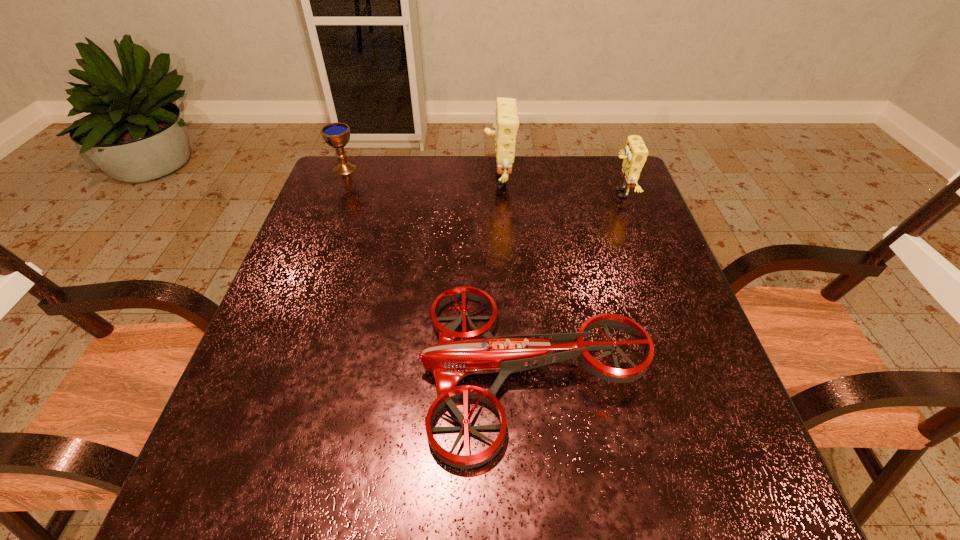
I want to click on free space that satisfies the following two spatial constraints: 1. on the face of the tallest object; 2. on the right side of the nearest object, so click(508, 369).

Locate an element on the screen. vacant area in the image that satisfies the following two spatial constraints: 1. on the back side of the nearest object; 2. on the face of the tallest object is located at coordinates (515, 178).

The height and width of the screenshot is (540, 960). Find the location of `free space in the image that satisfies the following two spatial constraints: 1. on the front side of the leftmost object; 2. on the left side of the nearest object`. free space in the image that satisfies the following two spatial constraints: 1. on the front side of the leftmost object; 2. on the left side of the nearest object is located at coordinates (267, 369).